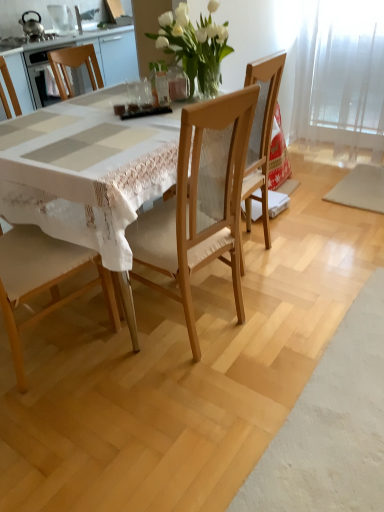
Find the location of a particular element. This screenshot has height=512, width=384. empty space that is to the right of wooden chair at center, positioned as the 2th chair in left-to-right order is located at coordinates (296, 246).